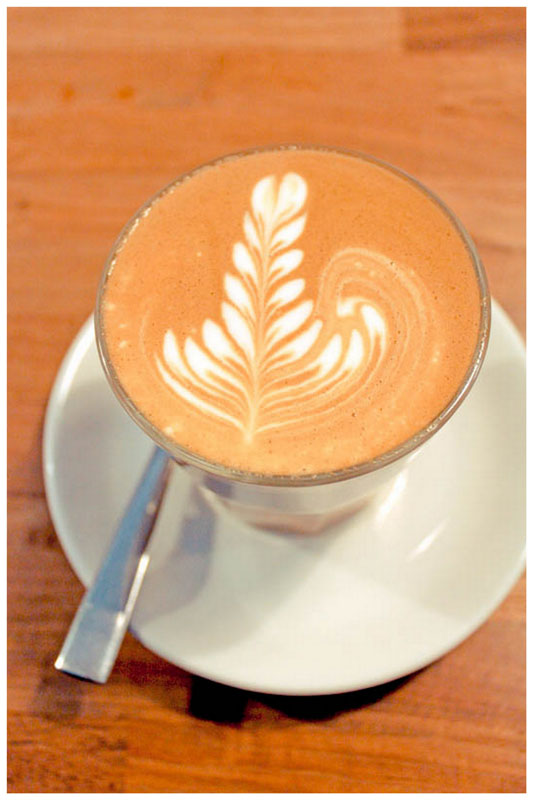
You are a GUI agent. You are given a task and a screenshot of the screen. Output one action in this format:
    pyautogui.click(x=<x>, y=<y>)
    Task: Click on the spoon
    This screenshot has width=533, height=800.
    Given the screenshot: What is the action you would take?
    pyautogui.click(x=125, y=582)